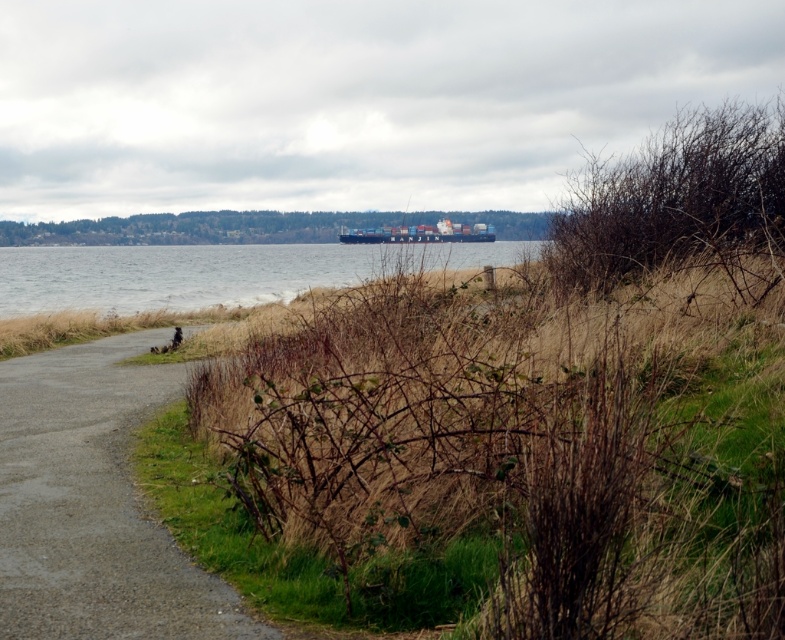
Which is behind, point (101, 273) or point (369, 241)?

Positioned behind is point (369, 241).

The height and width of the screenshot is (640, 785). What are the coordinates of `blue metallic water at center` in the screenshot? It's located at (214, 273).

Where is `blue metallic water at center`? Image resolution: width=785 pixels, height=640 pixels. blue metallic water at center is located at coordinates (214, 273).

Is gray asphalt path at lower left to the left of blue metallic water at center from the viewer's perspective?

Incorrect, gray asphalt path at lower left is not on the left side of blue metallic water at center.

Between gray asphalt path at lower left and blue metallic water at center, which one appears on the right side from the viewer's perspective?

gray asphalt path at lower left

Measure the distance between point (x=68, y=490) and camera.

Point (x=68, y=490) and camera are 29.69 feet apart.

This screenshot has height=640, width=785. I want to click on gray asphalt path at lower left, so click(x=93, y=504).

Identify the location of gray asphalt path at lower left. (93, 504).

I want to click on gray asphalt path at lower left, so click(93, 504).